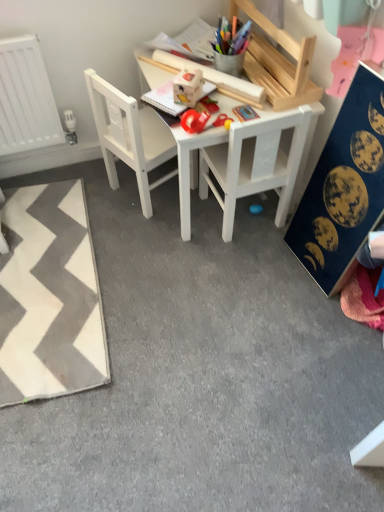
Image resolution: width=384 pixels, height=512 pixels. What are the coordinates of `free space in front of white wooden table at center` in the screenshot? It's located at (205, 280).